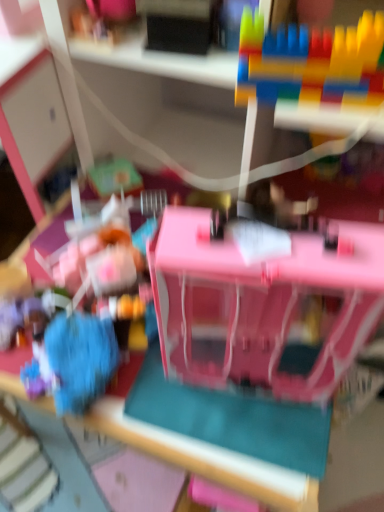
Question: Does pink plastic dollhouse at center, arranged as the second toy when viewed from the left, have a lesser width compared to blue fuzzy ball at lower left, which is the 1th toy from left to right?

Choices:
 (A) yes
 (B) no

Answer: (B)

Question: Considering the relative sizes of pink plastic dollhouse at center, the second toy viewed from the right, and blue fuzzy ball at lower left, which is the first toy in bottom-to-top order, in the image provided, is pink plastic dollhouse at center, the second toy viewed from the right, shorter than blue fuzzy ball at lower left, which is the first toy in bottom-to-top order,?

Choices:
 (A) yes
 (B) no

Answer: (B)

Question: From the image's perspective, is pink plastic dollhouse at center, the 2th toy when ordered from top to bottom, on blue fuzzy ball at lower left, the 3th toy when ordered from top to bottom?

Choices:
 (A) no
 (B) yes

Answer: (B)

Question: Can blue fuzzy ball at lower left, the 3th toy when ordered from top to bottom, be found inside pink plastic dollhouse at center, arranged as the second toy when viewed from the left?

Choices:
 (A) yes
 (B) no

Answer: (B)

Question: Is pink plastic dollhouse at center, the second toy in the bottom-to-top sequence, bigger than blue fuzzy ball at lower left, which is the first toy in bottom-to-top order?

Choices:
 (A) no
 (B) yes

Answer: (B)

Question: Is blue fuzzy ball at lower left, the 3th toy from the right, bigger or smaller than pink plastic dollhouse at center, the second toy viewed from the right?

Choices:
 (A) small
 (B) big

Answer: (A)

Question: Considering the positions of point (82, 410) and point (370, 243), is point (82, 410) closer or farther from the camera than point (370, 243)?

Choices:
 (A) closer
 (B) farther

Answer: (B)

Question: Choose the correct answer: Is blue fuzzy ball at lower left, the 3th toy from the right, inside pink plastic dollhouse at center, the 2th toy when ordered from top to bottom, or outside it?

Choices:
 (A) outside
 (B) inside

Answer: (A)

Question: From the image's perspective, is blue fuzzy ball at lower left, which is the first toy in bottom-to-top order, located above or below pink plastic dollhouse at center, arranged as the second toy when viewed from the left?

Choices:
 (A) below
 (B) above

Answer: (A)

Question: From a real-world perspective, is pink plastic dollhouse at center, arranged as the second toy when viewed from the left, physically located above or below blue fuzzy ball at lower left, the 3th toy from the right?

Choices:
 (A) below
 (B) above

Answer: (B)

Question: Considering their positions, is pink plastic dollhouse at center, arranged as the second toy when viewed from the left, located in front of or behind blue fuzzy ball at lower left, which is the first toy in bottom-to-top order?

Choices:
 (A) front
 (B) behind

Answer: (A)

Question: From the image's perspective, is pink plastic dollhouse at center, the 2th toy when ordered from top to bottom, positioned above or below blue fuzzy ball at lower left, the 3th toy from the right?

Choices:
 (A) above
 (B) below

Answer: (A)

Question: From their relative heights in the image, would you say pink plastic dollhouse at center, the 2th toy when ordered from top to bottom, is taller or shorter than blue fuzzy ball at lower left, which is the first toy in bottom-to-top order?

Choices:
 (A) short
 (B) tall

Answer: (B)

Question: Considering the positions of blue fuzzy ball at lower left, the 3th toy from the right, and multicolored plastic blocks at upper right, placed as the 1th toy when sorted from right to left, in the image, is blue fuzzy ball at lower left, the 3th toy from the right, taller or shorter than multicolored plastic blocks at upper right, placed as the 1th toy when sorted from right to left,?

Choices:
 (A) short
 (B) tall

Answer: (A)

Question: From the image's perspective, is blue fuzzy ball at lower left, the 3th toy from the right, located above or below multicolored plastic blocks at upper right, placed as the 1th toy when sorted from right to left?

Choices:
 (A) below
 (B) above

Answer: (A)